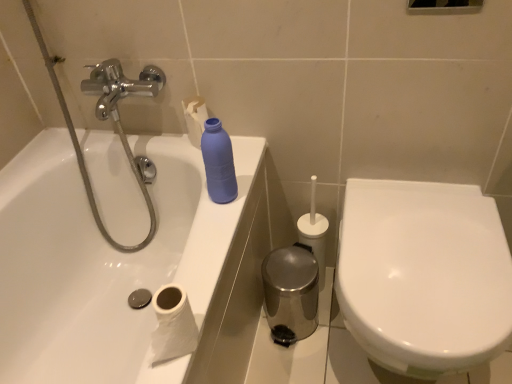
Question: Should I look upward or downward to see white paper at lower left?

Choices:
 (A) up
 (B) down

Answer: (B)

Question: Is white glossy toilet at right far from matte blue plastic bottle at upper center?

Choices:
 (A) yes
 (B) no

Answer: (B)

Question: Considering the relative sizes of white glossy toilet at right and matte blue plastic bottle at upper center in the image provided, is white glossy toilet at right taller than matte blue plastic bottle at upper center?

Choices:
 (A) no
 (B) yes

Answer: (B)

Question: Is white glossy toilet at right outside matte blue plastic bottle at upper center?

Choices:
 (A) yes
 (B) no

Answer: (A)

Question: From the image's perspective, is white glossy toilet at right under matte blue plastic bottle at upper center?

Choices:
 (A) no
 (B) yes

Answer: (B)

Question: Is white glossy toilet at right positioned before matte blue plastic bottle at upper center?

Choices:
 (A) no
 (B) yes

Answer: (B)

Question: Can you confirm if white glossy toilet at right is shorter than matte blue plastic bottle at upper center?

Choices:
 (A) no
 (B) yes

Answer: (A)

Question: Is white paper at lower left at the right side of matte blue plastic bottle at upper center?

Choices:
 (A) no
 (B) yes

Answer: (A)

Question: From the image's perspective, is white paper at lower left beneath matte blue plastic bottle at upper center?

Choices:
 (A) yes
 (B) no

Answer: (A)

Question: Is white paper at lower left thinner than matte blue plastic bottle at upper center?

Choices:
 (A) yes
 (B) no

Answer: (B)

Question: Considering the relative sizes of white paper at lower left and matte blue plastic bottle at upper center in the image provided, is white paper at lower left taller than matte blue plastic bottle at upper center?

Choices:
 (A) no
 (B) yes

Answer: (A)

Question: Considering the relative sizes of white paper at lower left and matte blue plastic bottle at upper center in the image provided, is white paper at lower left smaller than matte blue plastic bottle at upper center?

Choices:
 (A) no
 (B) yes

Answer: (A)

Question: Considering the relative positions of white paper at lower left and matte blue plastic bottle at upper center in the image provided, is white paper at lower left in front of matte blue plastic bottle at upper center?

Choices:
 (A) no
 (B) yes

Answer: (B)

Question: Is matte blue plastic bottle at upper center outside of white paper at lower left?

Choices:
 (A) no
 (B) yes

Answer: (B)